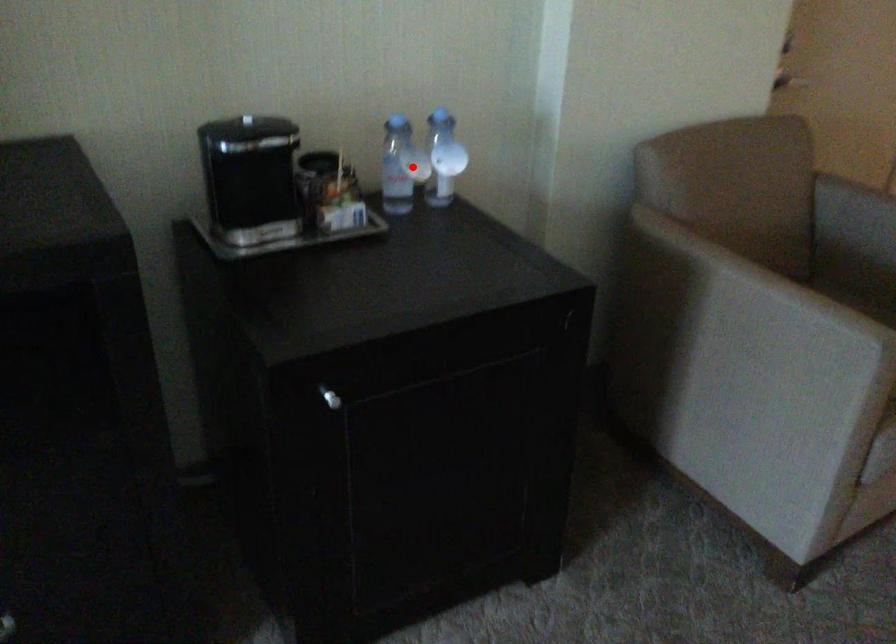
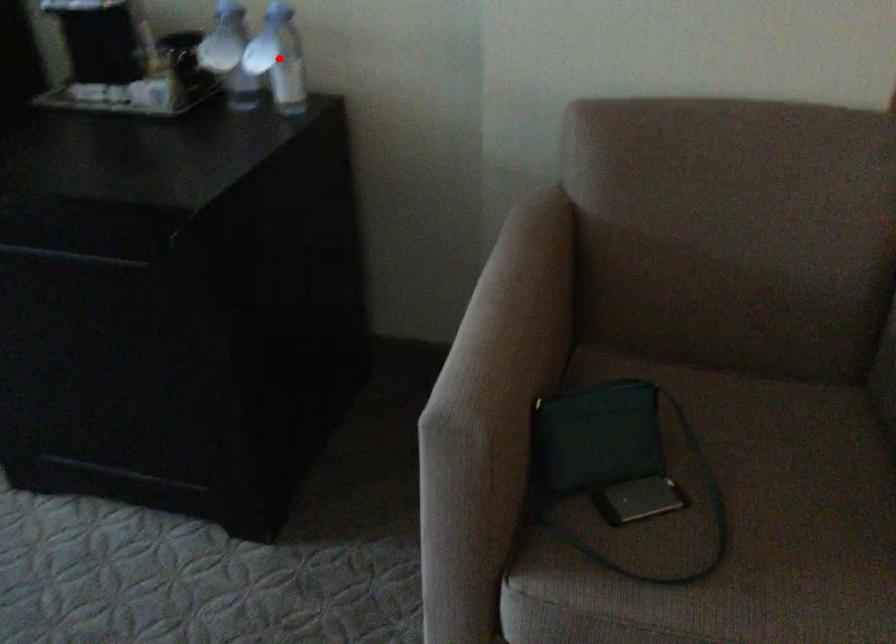
I am providing you with two images of the same scene from different viewpoints. A red point is marked on the first image and another point is marked on the second image. Are the points marked in image1 and image2 representing the same 3D position?

No